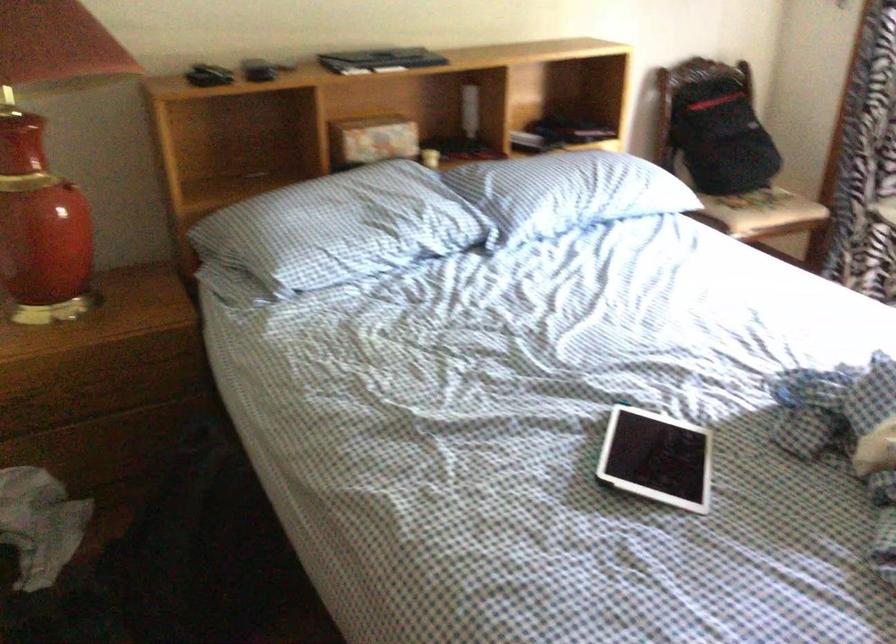
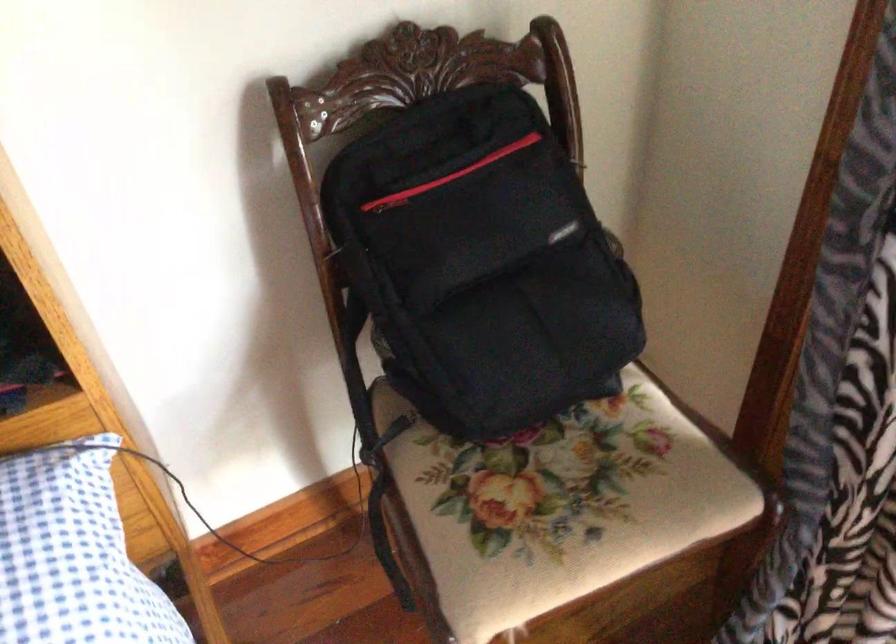
Find the pixel in the second image that matches pixel 707 91 in the first image.

(389, 202)